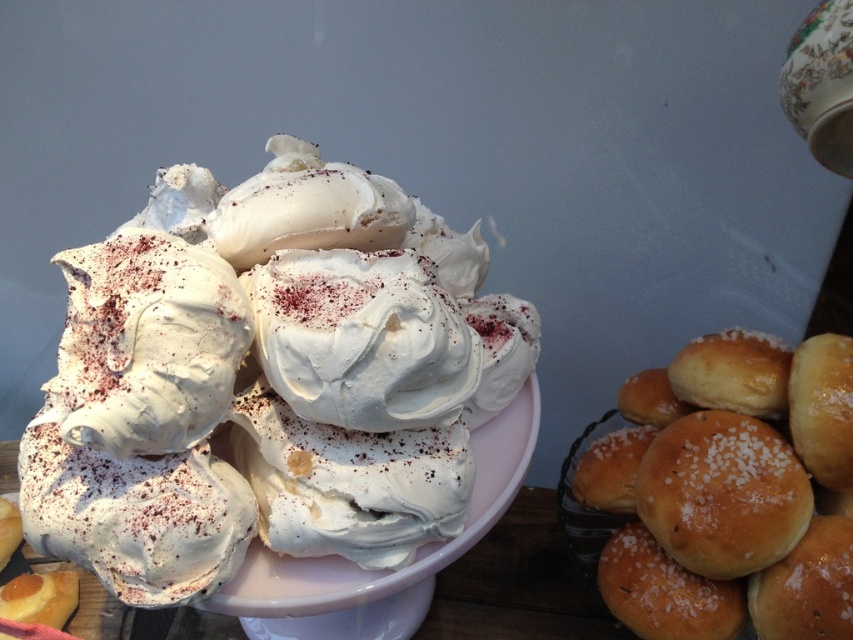
Does white fluffy meringue at center have a smaller size compared to slightly golden bread at right?

No, white fluffy meringue at center is not smaller than slightly golden bread at right.

Is point (410, 468) in front of point (680, 540)?

Yes, point (410, 468) is in front of point (680, 540).

Who is more forward, (103, 454) or (833, 600)?

Point (103, 454)

Locate an element on the screen. Image resolution: width=853 pixels, height=640 pixels. white fluffy meringue at center is located at coordinates (267, 380).